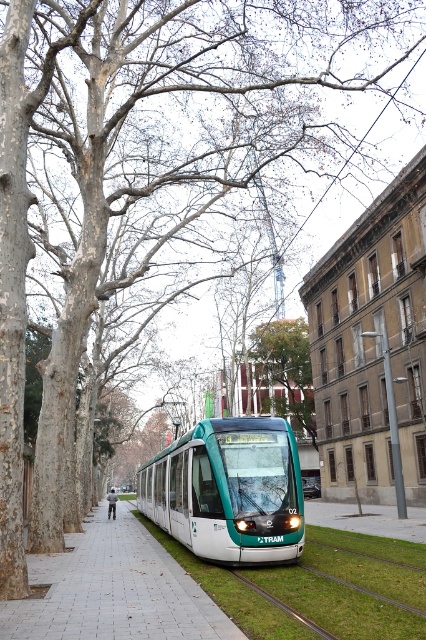
You are standing at the camera position and want to reach the point marked at coordinates (189, 486). The tram is blocking your path. Can you walk around the tram to reach the point without crossing the tram tracks?

The point marked at coordinates (189, 486) is 42.88 feet away from the camera. Since the tram is blocking the direct path, you can walk around it to reach the point without crossing the tram tracks as long as there is enough space around the tram to maneuver safely.

You are a pedestrian trying to cross the street. You see the teal glossy tram at center and the white tile pavement at center. Which object is on top of the other?

The teal glossy tram at center is positioned over the white tile pavement at center, so the tram is on top of the pavement.